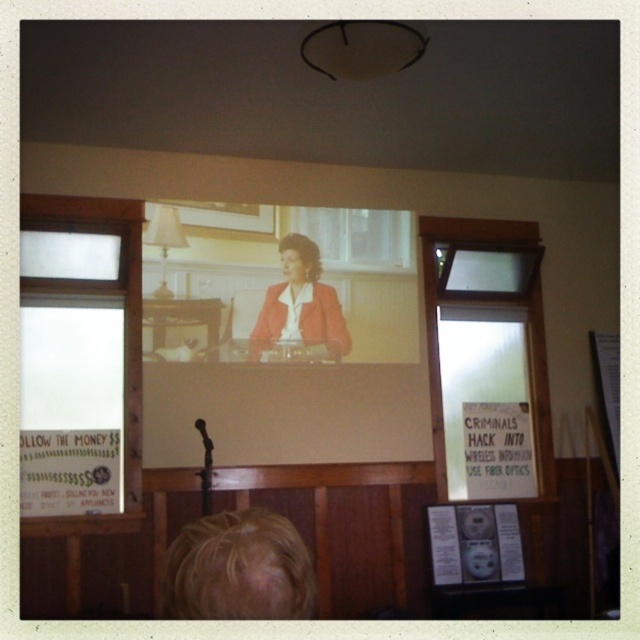
You are an attendee at the presentation and need to describe the speaker to a colleague who hasn t arrived yet. Which object from the scene is smaller, the blonde hair at lower left or the matte red blazer at center?

The blonde hair at lower left is smaller than the matte red blazer at center.